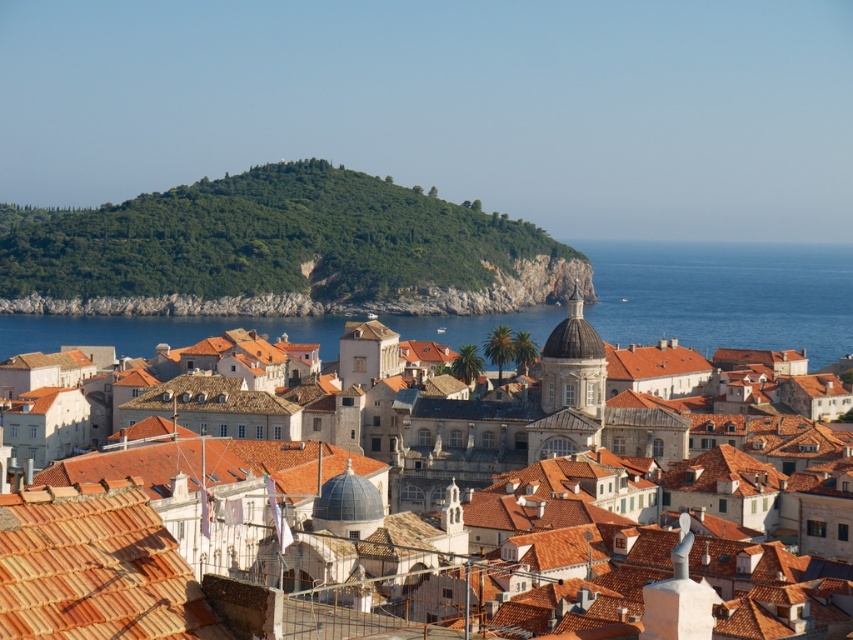
You are standing on a cliff overlooking the coastal town. You see the blue water at center and the matte orange tile roofs at center. Which one appears higher in your view?

The blue water at center appears higher in your view because it is taller than the matte orange tile roofs at center.

You are a tourist standing in the coastal town and want to take a photo that includes both the terracotta tiles at lower left and the blue water at center. Which object will appear smaller in the photo?

The terracotta tiles at lower left will appear smaller in the photo because they occupy less space than the blue water at center.